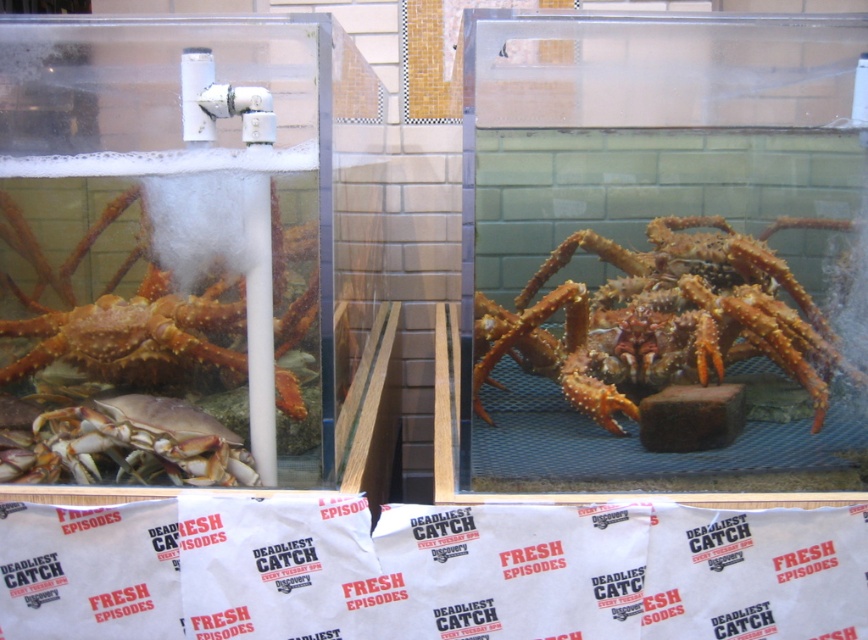
You are a marine biologist observing the two crabs in the aquarium tanks. You need to place a small sensor between them to monitor water conditions. The sensor requires a minimum of 24 inches of space to function properly. Based on the image, will the distance between the spiny orange crab at center and the shiny orange crab at left allow the sensor to be placed between them?

The distance between the spiny orange crab at center and the shiny orange crab at left is 24.25 inches, which is just over the minimum required 24 inches. Therefore, the sensor can be placed between them.

You are a marine biologist observing the two crab tanks. You need to reach the spiny orange crab at center and the smooth beige crab at left for a close inspection. Which crab will require you to move closer to the tank?

The spiny orange crab at center is closer to the viewer than the smooth beige crab at left, so you need to move closer to reach the smooth beige crab at left.

You are standing in front of the aquarium tanks and want to take a photo of the point at coordinate point (531, 332). Your camera has a focal length of 50mm and an image sensor size of 24mm. What is the minimum distance you need to be from the point to ensure the entire scene fits in your camera frame?

The point at coordinate point (531, 332) is 1.58 meters away from the camera. To ensure the entire scene fits in the camera frame with a focal length of 50mm and a 24mm sensor, the minimum distance should be calculated using the formula distance > focal length multiplied by sensor size divided by field of view. However, without the field of view, we can only state the current distance is 1.58 meters.